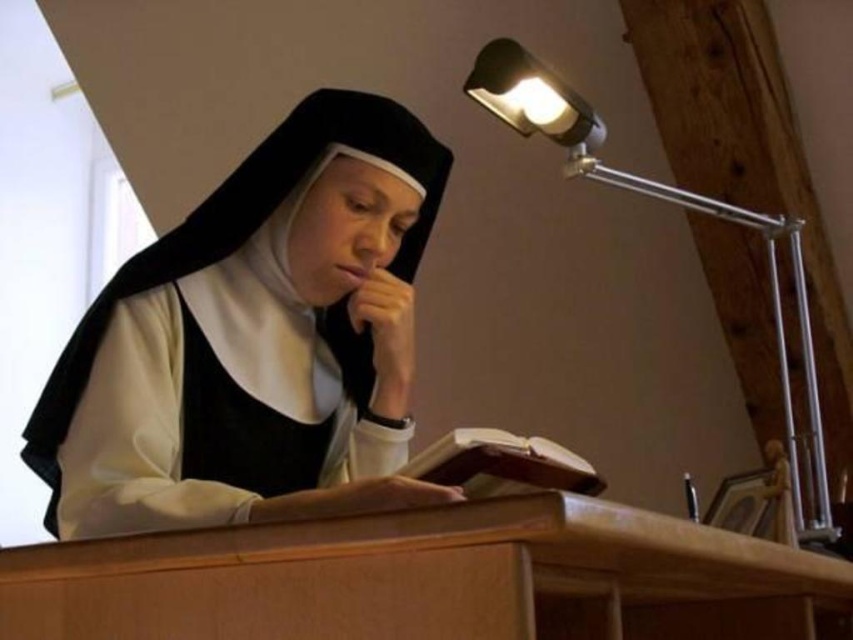
You are a delivery person who needs to place a small package on the desk between the light brown wooden table at center and the metallic silver desk lamp at upper right. The package is 10 inches wide. Can you fit it between them without moving either object?

The distance between the light brown wooden table at center and the metallic silver desk lamp at upper right is 26.90 inches. Since the package is only 10 inches wide, there is enough space to place it between them without moving either object.

You are an interior designer planning to place a new decorative item on the desk. The item is 1.2 meters wide. Considering the current objects on the desk, which are the matte black habit at center and the brown leather book at center, will there be enough space to accommodate the new item without moving any existing objects?

The matte black habit at center might be wider than the brown leather book at center. If the habit is wider, it could take up more space on the desk. However, since the exact width of the habit isn not provided, it is uncertain whether the 1.2 meter wide item will fit without moving existing objects.